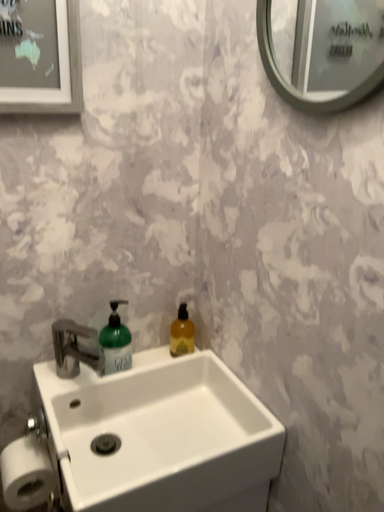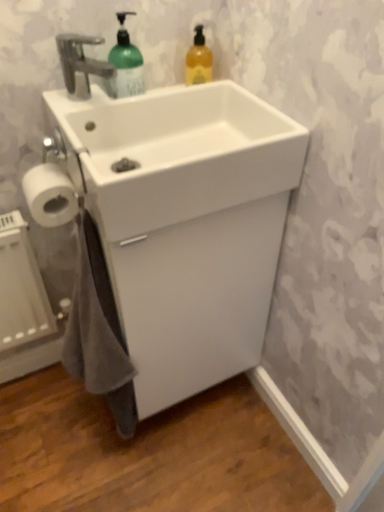
Question: Which way did the camera rotate in the video?

Choices:
 (A) rotated upward
 (B) rotated downward

Answer: (B)